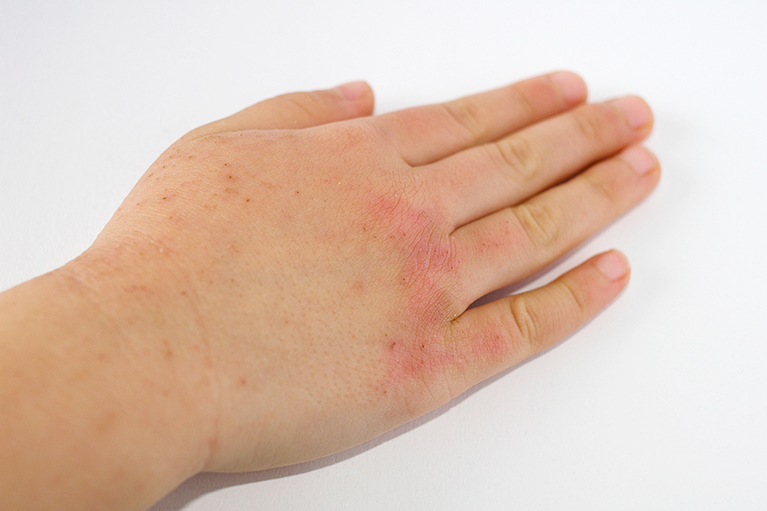
The image size is (767, 511). What are the coordinates of `surface` in the screenshot? It's located at (561, 467).